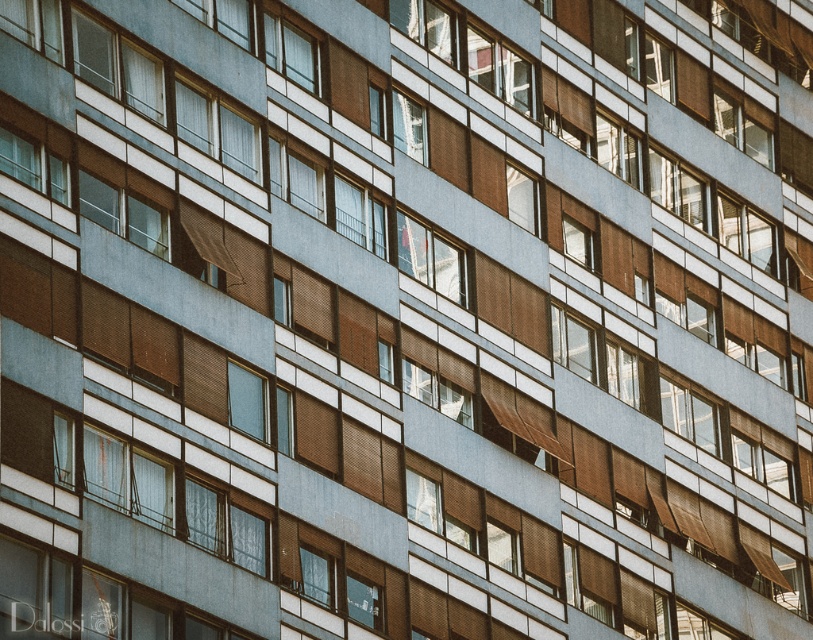
Looking at this image, is matte glass window at center positioned in front of transparent glass window at center?

Yes.

Who is positioned more to the left, matte glass window at center or transparent glass window at center?

matte glass window at center is more to the left.

Is point (320, 589) closer to viewer compared to point (587, 244)?

Yes, it is in front of point (587, 244).

Locate an element on the screen. The width and height of the screenshot is (813, 640). matte glass window at center is located at coordinates (316, 576).

Is clear glass window at upper center shorter than matte glass window at center?

No.

Who is more distant from viewer, (298, 52) or (312, 598)?

Point (298, 52)

At what (x,y) coordinates should I click in order to perform the action: click on clear glass window at upper center. Please return your answer as a coordinate pair (x, y). Looking at the image, I should click on (290, 52).

Can you confirm if clear glass window at upper center is smaller than transparent glass window at center?

Incorrect, clear glass window at upper center is not smaller in size than transparent glass window at center.

Between clear glass window at upper center and transparent glass window at center, which one appears on the right side from the viewer's perspective?

From the viewer's perspective, transparent glass window at center appears more on the right side.

Which is behind, point (268, 40) or point (588, 244)?

The point (588, 244) is more distant.

The width and height of the screenshot is (813, 640). Identify the location of clear glass window at upper center. (290, 52).